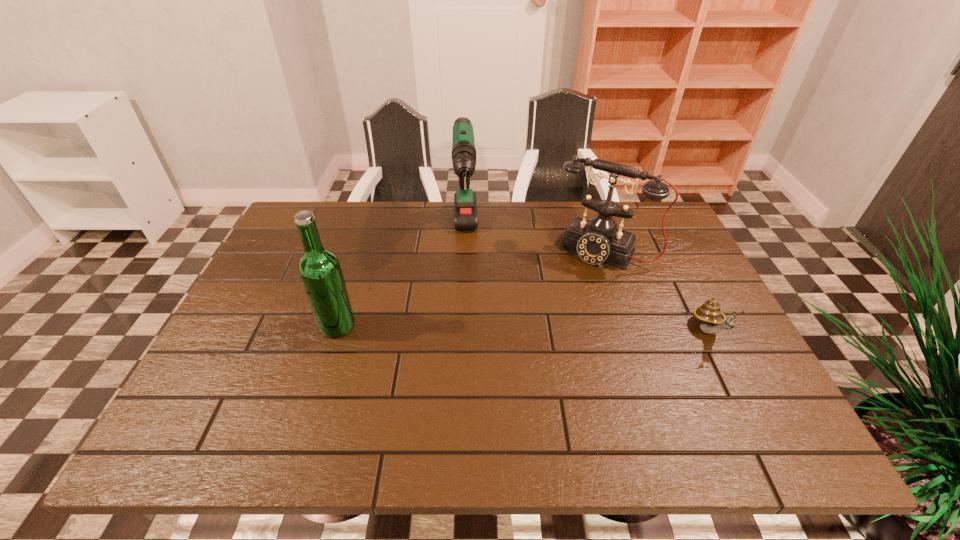
You are a GUI agent. You are given a task and a screenshot of the screen. Output one action in this format:
    pyautogui.click(x=<x>, y=<y>)
    Task: Click on the free point at the right edge
    This screenshot has height=540, width=960.
    Given the screenshot: What is the action you would take?
    pyautogui.click(x=692, y=343)

Image resolution: width=960 pixels, height=540 pixels. What are the coordinates of `vacant position at the far left corner of the desktop` in the screenshot? It's located at (332, 218).

Identify the location of free space at the near left corner of the desktop. The height and width of the screenshot is (540, 960). pyautogui.click(x=268, y=397).

You are a GUI agent. You are given a task and a screenshot of the screen. Output one action in this format:
    pyautogui.click(x=<x>, y=<y>)
    Task: Click on the free space at the far right corner of the desktop
    The width and height of the screenshot is (960, 540).
    Given the screenshot: What is the action you would take?
    pyautogui.click(x=644, y=202)

This screenshot has width=960, height=540. Identify the location of blank region between the beer bottle and the second object from right to left. (470, 288).

Where is `free space between the second object from right to left and the third object from right to left`? This screenshot has width=960, height=540. free space between the second object from right to left and the third object from right to left is located at coordinates (534, 243).

At what (x,y) coordinates should I click in order to perform the action: click on free spot between the snail and the beer bottle. Please return your answer as a coordinate pair (x, y). The height and width of the screenshot is (540, 960). Looking at the image, I should click on (523, 328).

At what (x,y) coordinates should I click in order to perform the action: click on free space between the rightmost object and the second object from left to right. Please return your answer as a coordinate pair (x, y). Image resolution: width=960 pixels, height=540 pixels. Looking at the image, I should click on (588, 284).

The image size is (960, 540). What are the coordinates of `free space between the telephone and the snail` in the screenshot? It's located at (657, 291).

Find the location of a particular element. This screenshot has width=960, height=540. empty location between the rightmost object and the third object from right to left is located at coordinates (588, 284).